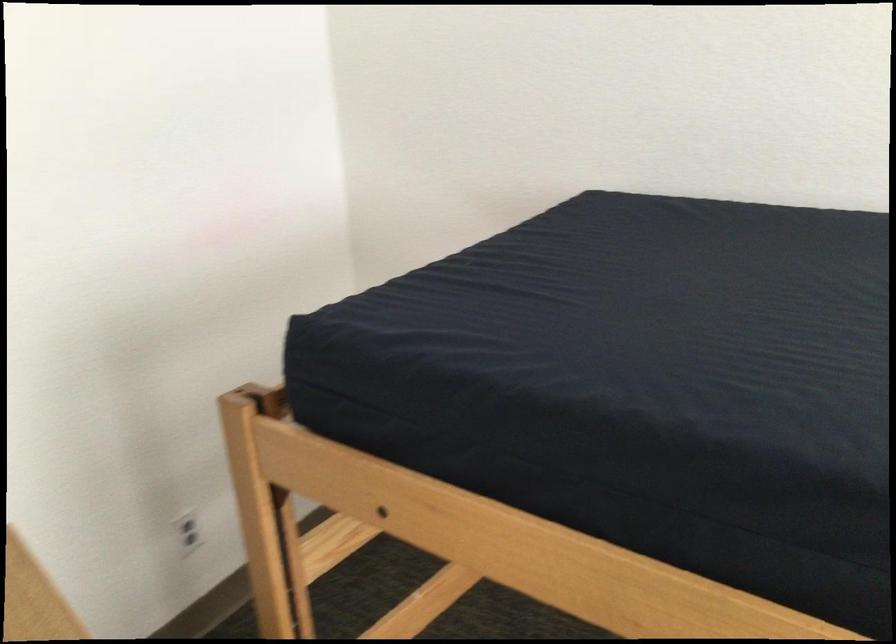
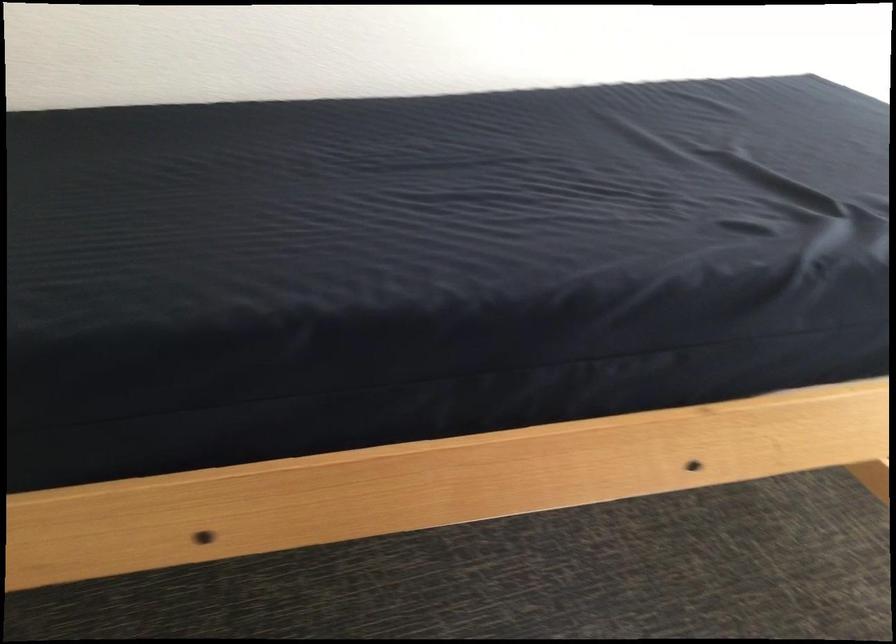
Question: The camera is either moving clockwise (left) or counter-clockwise (right) around the object. The first image is from the beginning of the video and the second image is from the end. Is the camera moving left or right when shooting the video?

Choices:
 (A) Left
 (B) Right

Answer: (A)